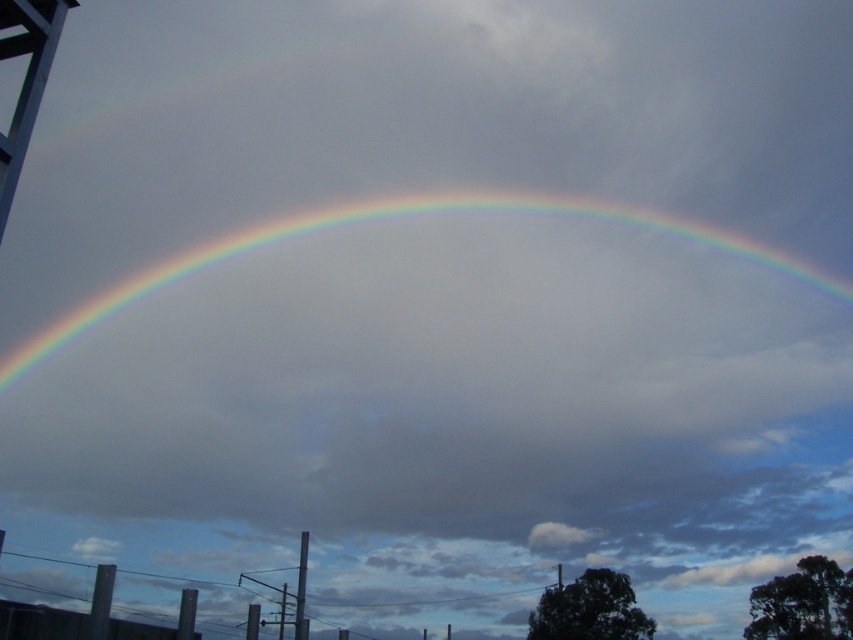
You are standing at point A located at coordinates (392, 218) in the image. Looking up, you notice a rainbow. Where exactly is the rainbow in relation to your position?

The rainbow is at the center relative to your position at point A located at coordinates (392, 218).

You are a photographer trying to capture the rainbow at center and the white matte water tower at upper left in the same frame. Based on their positions, which object is higher in the image?

The rainbow at center is above the white matte water tower at upper left, so the rainbow at center is higher in the image.